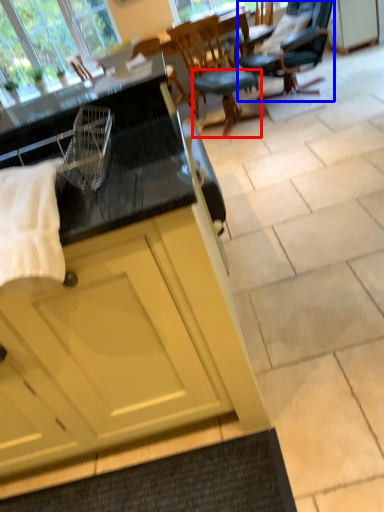
Question: Which object appears farthest to the camera in this image, stool (highlighted by a red box) or chair (highlighted by a blue box)?

Choices:
 (A) stool
 (B) chair

Answer: (A)